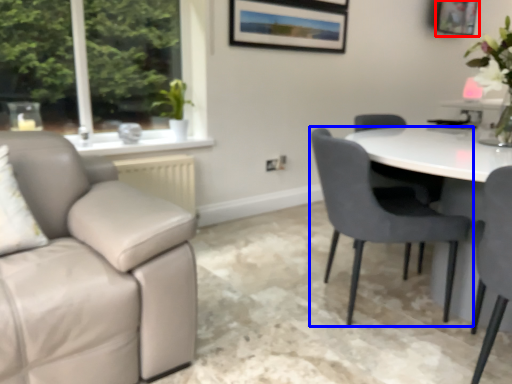
Question: Which point is closer to the camera, picture frame (highlighted by a red box) or chair (highlighted by a blue box)?

Choices:
 (A) picture frame
 (B) chair

Answer: (B)